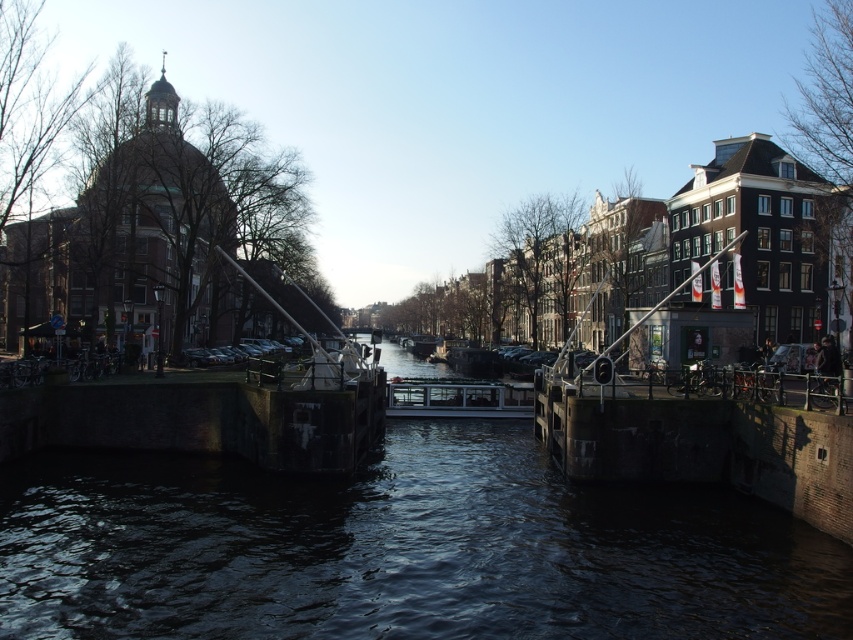
Question: Is dark concrete water at center thinner than metallic glass boat at center?

Choices:
 (A) no
 (B) yes

Answer: (A)

Question: Which point is farther to the camera?

Choices:
 (A) dark concrete water at center
 (B) metallic glass boat at center

Answer: (B)

Question: Does dark concrete water at center have a smaller size compared to metallic glass boat at center?

Choices:
 (A) yes
 (B) no

Answer: (B)

Question: Can you confirm if dark concrete water at center is positioned to the right of metallic glass boat at center?

Choices:
 (A) no
 (B) yes

Answer: (A)